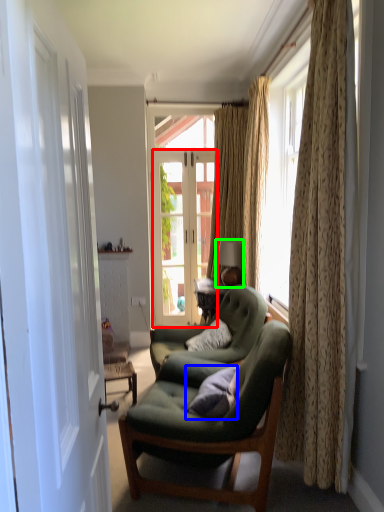
Question: Considering the real-world distances, which object is farthest from door (highlighted by a red box)? pillow (highlighted by a blue box) or lamp (highlighted by a green box)?

Choices:
 (A) pillow
 (B) lamp

Answer: (A)